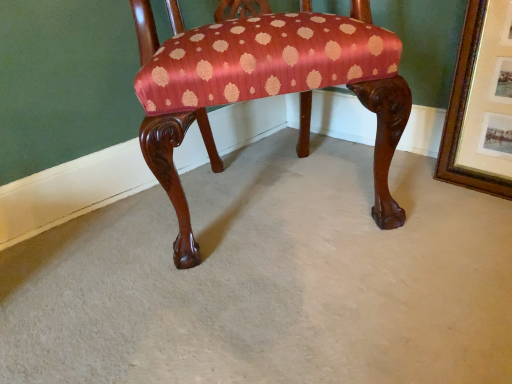
Question: Is gold-framed picture at upper right situated inside silky red-patterned chair at center or outside?

Choices:
 (A) outside
 (B) inside

Answer: (A)

Question: Considering the relative positions of gold-framed picture at upper right and silky red-patterned chair at center in the image provided, is gold-framed picture at upper right to the left or to the right of silky red-patterned chair at center?

Choices:
 (A) right
 (B) left

Answer: (A)

Question: Is point (483, 1) closer or farther from the camera than point (387, 46)?

Choices:
 (A) closer
 (B) farther

Answer: (B)

Question: From the image's perspective, is silky red-patterned chair at center located above or below gold-framed picture at upper right?

Choices:
 (A) above
 (B) below

Answer: (A)

Question: Would you say silky red-patterned chair at center is to the left or to the right of gold-framed picture at upper right in the picture?

Choices:
 (A) left
 (B) right

Answer: (A)

Question: Considering the positions of silky red-patterned chair at center and gold-framed picture at upper right in the image, is silky red-patterned chair at center wider or thinner than gold-framed picture at upper right?

Choices:
 (A) wide
 (B) thin

Answer: (A)

Question: In the image, is silky red-patterned chair at center positioned in front of or behind gold-framed picture at upper right?

Choices:
 (A) behind
 (B) front

Answer: (B)